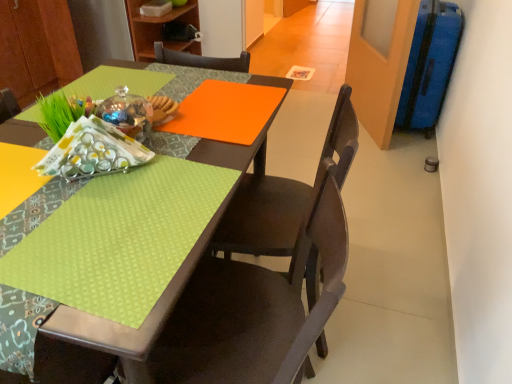
What do you see at coordinates (429, 65) in the screenshot? I see `blue textured suitcase at right` at bounding box center [429, 65].

What is the approximate height of lime green fabric at lower left?

0.54 inches.

In order to face wooden bookshelf at upper center, should I rotate leftwards or rightwards?

You should look left and rotate roughly 11.433 degrees.

This screenshot has width=512, height=384. Describe the element at coordinates (262, 217) in the screenshot. I see `matte dark wood chair at center, which ranks as the second chair in front-to-back order` at that location.

What do you see at coordinates (252, 309) in the screenshot?
I see `matte brown chair at lower center, the second chair in the back-to-front sequence` at bounding box center [252, 309].

At what (x,y) coordinates should I click in order to perform the action: click on blue textured suitcase at right. Please return your answer as a coordinate pair (x, y). The height and width of the screenshot is (384, 512). Looking at the image, I should click on (x=429, y=65).

From the picture: From a real-world perspective, is lime green fabric at lower left on matte brown chair at lower center, the second chair in the back-to-front sequence?

Yes, from a real-world perspective, lime green fabric at lower left is above matte brown chair at lower center, the second chair in the back-to-front sequence.

Is lime green fabric at lower left next to matte brown chair at lower center, the second chair in the back-to-front sequence, and touching it?

lime green fabric at lower left and matte brown chair at lower center, the second chair in the back-to-front sequence, are not in contact.

From the image's perspective, relative to matte brown chair at lower center, acting as the 1th chair starting from the front, is lime green fabric at lower left above or below?

From the image's perspective, lime green fabric at lower left appears above matte brown chair at lower center, acting as the 1th chair starting from the front.

Is the depth of lime green fabric at lower left greater than that of matte brown chair at lower center, acting as the 1th chair starting from the front?

That is True.

How many degrees apart are the facing directions of blue textured suitcase at right and lime green fabric at lower left?

The facing directions of blue textured suitcase at right and lime green fabric at lower left are 2.49 degrees apart.

Is blue textured suitcase at right to the left of lime green fabric at lower left from the viewer's perspective?

No.

In the scene shown: From the image's perspective, which is above, blue textured suitcase at right or lime green fabric at lower left?

blue textured suitcase at right is shown above in the image.

Would you say blue textured suitcase at right is a long distance from lime green fabric at lower left?

Yes, blue textured suitcase at right and lime green fabric at lower left are located far from each other.

Between matte dark wood chair at center, which ranks as the second chair in front-to-back order, and matte brown chair at lower center, the second chair in the back-to-front sequence, which one has smaller width?

Thinner between the two is matte dark wood chair at center, which ranks as the second chair in front-to-back order.

Which object is closer to the camera taking this photo, matte dark wood chair at center, which ranks as the second chair in front-to-back order, or matte brown chair at lower center, the second chair in the back-to-front sequence?

matte brown chair at lower center, the second chair in the back-to-front sequence, is in front.

Considering the relative positions of matte dark wood chair at center, arranged as the 1th chair when viewed from the back, and matte brown chair at lower center, acting as the 1th chair starting from the front, in the image provided, is matte dark wood chair at center, arranged as the 1th chair when viewed from the back, to the left of matte brown chair at lower center, acting as the 1th chair starting from the front, from the viewer's perspective?

Incorrect, matte dark wood chair at center, arranged as the 1th chair when viewed from the back, is not on the left side of matte brown chair at lower center, acting as the 1th chair starting from the front.

Is matte dark wood chair at center, which ranks as the second chair in front-to-back order, inside the boundaries of matte brown chair at lower center, acting as the 1th chair starting from the front, or outside?

matte dark wood chair at center, which ranks as the second chair in front-to-back order, is outside matte brown chair at lower center, acting as the 1th chair starting from the front.

Can you confirm if matte brown chair at lower center, acting as the 1th chair starting from the front, is taller than matte dark wood chair at center, arranged as the 1th chair when viewed from the back?

Correct, matte brown chair at lower center, acting as the 1th chair starting from the front, is much taller as matte dark wood chair at center, arranged as the 1th chair when viewed from the back.

Locate an element on the screen. The height and width of the screenshot is (384, 512). chair behind the matte brown chair at lower center, the second chair in the back-to-front sequence is located at coordinates (262, 217).

From the image's perspective, would you say matte brown chair at lower center, the second chair in the back-to-front sequence, is shown under matte dark wood chair at center, which ranks as the second chair in front-to-back order?

Correct, matte brown chair at lower center, the second chair in the back-to-front sequence, appears lower than matte dark wood chair at center, which ranks as the second chair in front-to-back order, in the image.

From a real-world perspective, is lime green fabric at lower left physically below matte dark wood chair at center, arranged as the 1th chair when viewed from the back?

No, from a real-world perspective, lime green fabric at lower left is not under matte dark wood chair at center, arranged as the 1th chair when viewed from the back.

Does lime green fabric at lower left have a greater height compared to matte dark wood chair at center, which ranks as the second chair in front-to-back order?

Incorrect, the height of lime green fabric at lower left is not larger of that of matte dark wood chair at center, which ranks as the second chair in front-to-back order.

Can you see lime green fabric at lower left touching matte dark wood chair at center, arranged as the 1th chair when viewed from the back?

No, lime green fabric at lower left is not beside matte dark wood chair at center, arranged as the 1th chair when viewed from the back.

Can you tell me how much lime green fabric at lower left and matte dark wood chair at center, which ranks as the second chair in front-to-back order, differ in facing direction?

12.4 degrees separate the facing orientations of lime green fabric at lower left and matte dark wood chair at center, which ranks as the second chair in front-to-back order.

Which object is positioned more to the left, matte dark wood chair at center, arranged as the 1th chair when viewed from the back, or wooden bookshelf at upper center?

wooden bookshelf at upper center.

Between matte dark wood chair at center, which ranks as the second chair in front-to-back order, and wooden bookshelf at upper center, which one has larger size?

matte dark wood chair at center, which ranks as the second chair in front-to-back order.

Which is closer to the camera, (x=194, y=22) or (x=234, y=331)?

The point (x=234, y=331) is in front.

Is wooden bookshelf at upper center turned away from matte brown chair at lower center, the second chair in the back-to-front sequence?

No, matte brown chair at lower center, the second chair in the back-to-front sequence, is not at the back of wooden bookshelf at upper center.

Does wooden bookshelf at upper center have a smaller size compared to matte brown chair at lower center, the second chair in the back-to-front sequence?

Yes, wooden bookshelf at upper center is smaller than matte brown chair at lower center, the second chair in the back-to-front sequence.

Which of these two, wooden bookshelf at upper center or matte brown chair at lower center, acting as the 1th chair starting from the front, is thinner?

Thinner between the two is matte brown chair at lower center, acting as the 1th chair starting from the front.

The height and width of the screenshot is (384, 512). Find the location of `chair in front of the lime green fabric at lower left`. chair in front of the lime green fabric at lower left is located at coordinates (252, 309).

At what (x,y) coordinates should I click in order to perform the action: click on tablecloth below the blue textured suitcase at right (from the image's perspective). Please return your answer as a coordinate pair (x, y). The height and width of the screenshot is (384, 512). Looking at the image, I should click on (120, 238).

When comparing their distances from matte brown chair at lower center, the second chair in the back-to-front sequence, does wooden bookshelf at upper center or matte dark wood chair at center, which ranks as the second chair in front-to-back order, seem closer?

matte dark wood chair at center, which ranks as the second chair in front-to-back order, is positioned closer to the anchor matte brown chair at lower center, the second chair in the back-to-front sequence.

From the image, which object appears to be farther from matte brown chair at lower center, acting as the 1th chair starting from the front, lime green fabric at lower left or matte dark wood chair at center, arranged as the 1th chair when viewed from the back?

lime green fabric at lower left lies further to matte brown chair at lower center, acting as the 1th chair starting from the front, than the other object.

Considering their positions, is matte brown chair at lower center, acting as the 1th chair starting from the front, positioned further to wooden bookshelf at upper center than lime green fabric at lower left?

matte brown chair at lower center, acting as the 1th chair starting from the front.

When comparing their distances from lime green fabric at lower left, does matte dark wood chair at center, arranged as the 1th chair when viewed from the back, or wooden bookshelf at upper center seem further?

wooden bookshelf at upper center.

In the scene shown: Looking at the image, which one is located further to matte brown chair at lower center, the second chair in the back-to-front sequence, blue textured suitcase at right or matte dark wood chair at center, which ranks as the second chair in front-to-back order?

Based on the image, blue textured suitcase at right appears to be further to matte brown chair at lower center, the second chair in the back-to-front sequence.

Estimate the real-world distances between objects in this image. Which object is further from matte brown chair at lower center, acting as the 1th chair starting from the front, wooden bookshelf at upper center or blue textured suitcase at right?

wooden bookshelf at upper center lies further to matte brown chair at lower center, acting as the 1th chair starting from the front, than the other object.

Which object lies nearer to the anchor point blue textured suitcase at right, lime green fabric at lower left or matte brown chair at lower center, the second chair in the back-to-front sequence?

Based on the image, matte brown chair at lower center, the second chair in the back-to-front sequence, appears to be nearer to blue textured suitcase at right.

Estimate the real-world distances between objects in this image. Which object is closer to wooden bookshelf at upper center, blue textured suitcase at right or matte brown chair at lower center, acting as the 1th chair starting from the front?

The object closer to wooden bookshelf at upper center is blue textured suitcase at right.

Locate an element on the screen. tablecloth between matte brown chair at lower center, acting as the 1th chair starting from the front, and matte dark wood chair at center, which ranks as the second chair in front-to-back order, in the front-back direction is located at coordinates (120, 238).

You are a GUI agent. You are given a task and a screenshot of the screen. Output one action in this format:
    pyautogui.click(x=<x>, y=<y>)
    Task: Click on the chair between lime green fabric at lower left and wooden bookshelf at upper center from front to back
    The image size is (512, 384).
    Given the screenshot: What is the action you would take?
    pyautogui.click(x=262, y=217)

I want to click on luggage located between lime green fabric at lower left and wooden bookshelf at upper center in the depth direction, so click(429, 65).

I want to click on tablecloth between matte brown chair at lower center, the second chair in the back-to-front sequence, and wooden bookshelf at upper center from front to back, so click(120, 238).